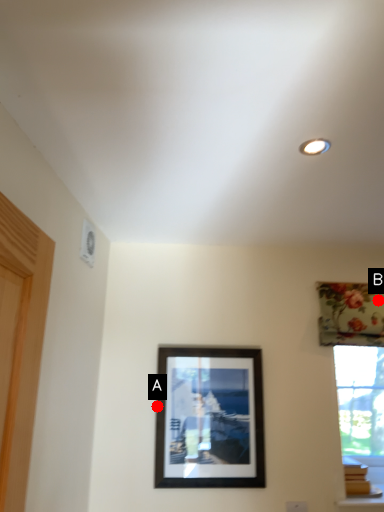
Question: Two points are circled on the image, labeled by A and B beside each circle. Among these points, which one is farthest from the camera?

Choices:
 (A) A is further
 (B) B is further

Answer: (B)